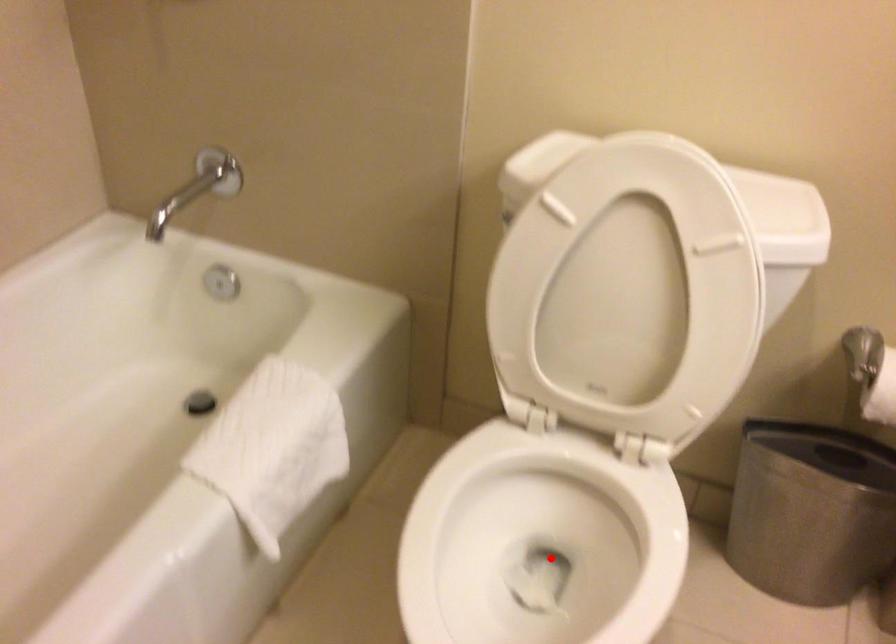
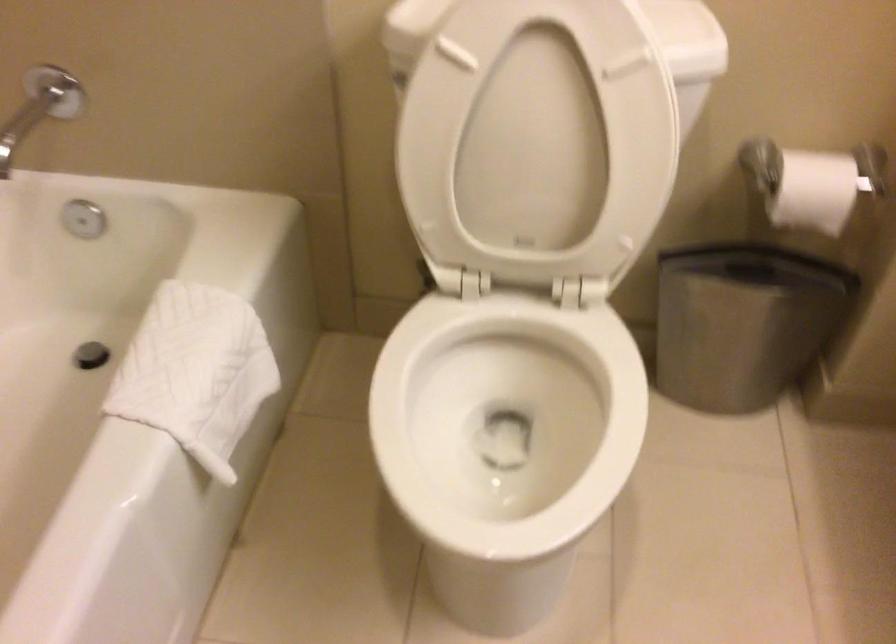
Locate, in the second image, the point that corresponds to the highlighted location in the first image.

(505, 420)